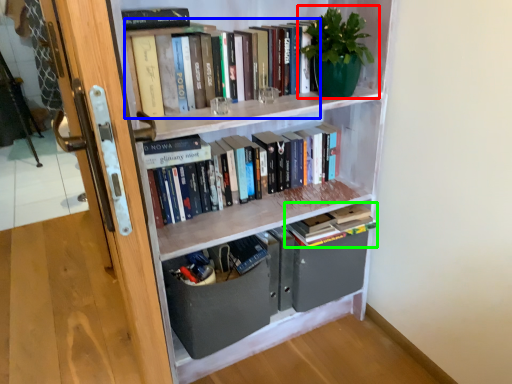
Question: Estimate the real-world distances between objects in this image. Which object is farther from houseplant (highlighted by a red box), book (highlighted by a blue box) or book (highlighted by a green box)?

Choices:
 (A) book
 (B) book

Answer: (B)